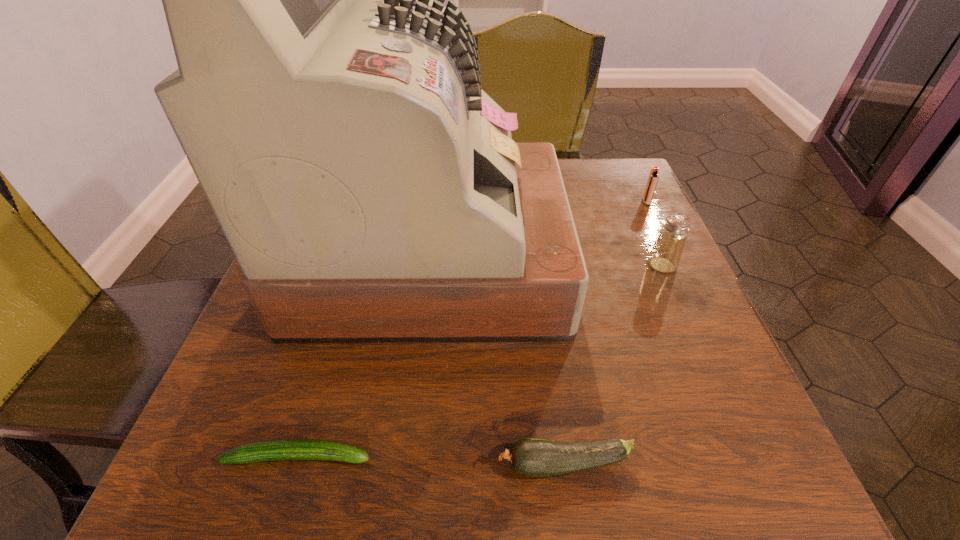
Identify the location of free space located 0.230m at the blossom end of the taller zucchini. (325, 464).

The width and height of the screenshot is (960, 540). Identify the location of free space located 0.300m at the blossom end of the taller zucchini. (274, 464).

Image resolution: width=960 pixels, height=540 pixels. What are the coordinates of `free space located 0.090m at the blossom end of the taller zucchini` in the screenshot? It's located at (430, 464).

Find the location of a particular element. vacant space positioned on the front-facing side of the shortest object is located at coordinates (666, 456).

The height and width of the screenshot is (540, 960). What are the coordinates of `cash register present at the far edge` in the screenshot? It's located at (330, 105).

This screenshot has width=960, height=540. I want to click on igniter that is at the far edge, so click(653, 177).

Where is `cash register at the left edge`? The height and width of the screenshot is (540, 960). cash register at the left edge is located at coordinates (330, 105).

I want to click on zucchini located in the left edge section of the desktop, so click(286, 449).

Identify the location of saltshaker located at the right edge. This screenshot has width=960, height=540. pyautogui.click(x=665, y=255).

I want to click on igniter at the right edge, so click(x=653, y=177).